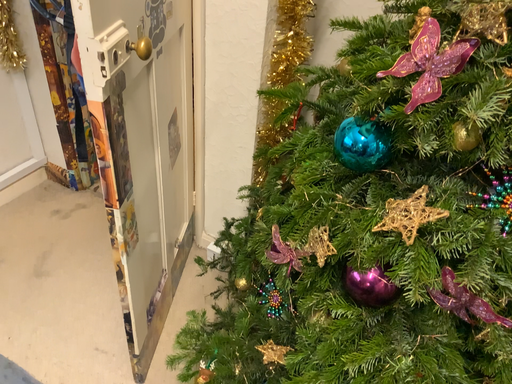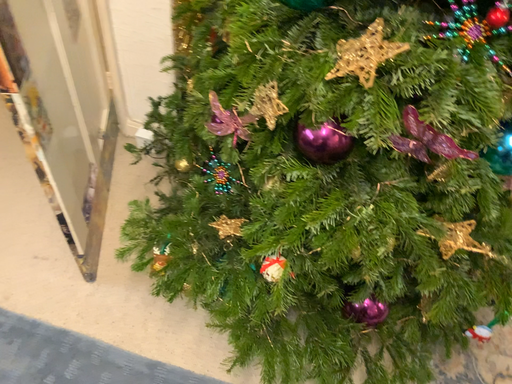
Question: Which way did the camera rotate in the video?

Choices:
 (A) rotated right
 (B) rotated left

Answer: (A)